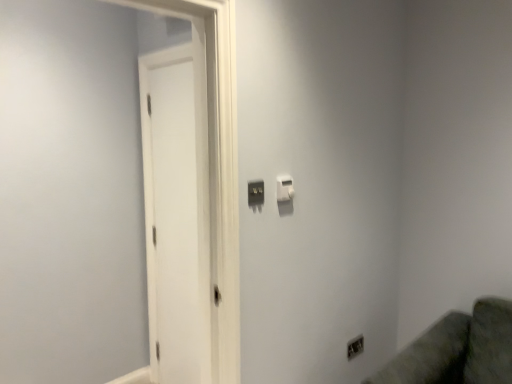
Question: In terms of width, does white matte door at left look wider or thinner when compared to satin silver outlet at lower right?

Choices:
 (A) thin
 (B) wide

Answer: (B)

Question: Is point (179, 294) positioned closer to the camera than point (353, 342)?

Choices:
 (A) farther
 (B) closer

Answer: (A)

Question: Which object is positioned closest to the matte black switch at center, which is the second light switch in right-to-left order?

Choices:
 (A) satin silver outlet at lower right
 (B) white matte door at left
 (C) white plastic light switch at upper center, which appears as the 2th light switch when viewed from the left

Answer: (C)

Question: Which object is the closest to the matte black switch at center, which is the 1th light switch from left to right?

Choices:
 (A) white plastic light switch at upper center, which is the first light switch in back-to-front order
 (B) white matte door at left
 (C) satin silver outlet at lower right

Answer: (A)